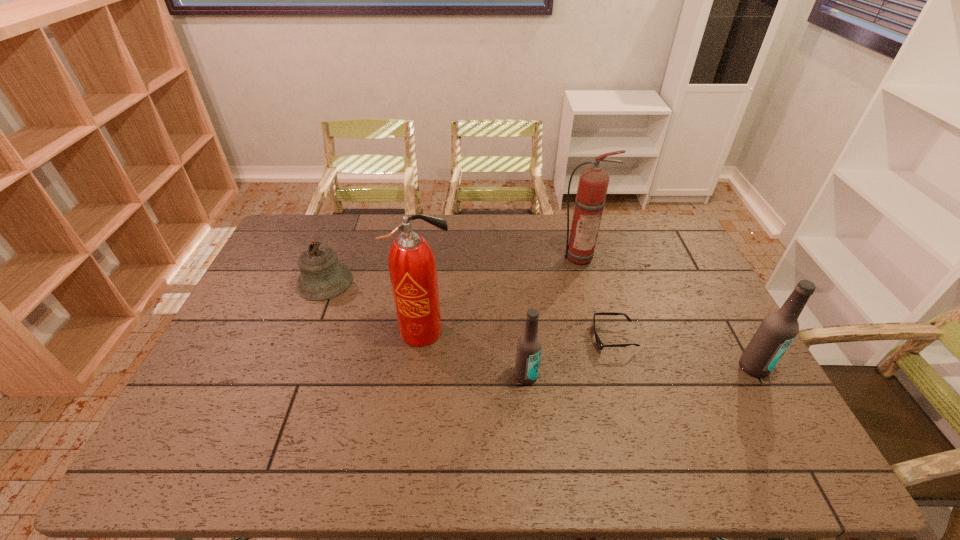
Please point out where to position a new beer bottle on the left to maintain spacing. Please provide its 2D coordinates. Your answer should be formatted as a tuple, i.e. [(x, y)], where the tuple contains the x and y coordinates of a point satisfying the conditions above.

[(290, 385)]